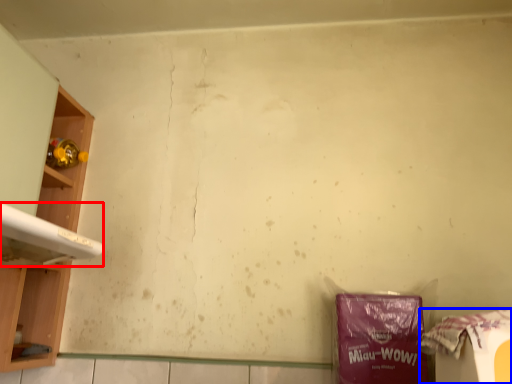
Question: Which of the following is the closest to the observer, washing (highlighted by a red box) or waste (highlighted by a blue box)?

Choices:
 (A) washing
 (B) waste

Answer: (B)